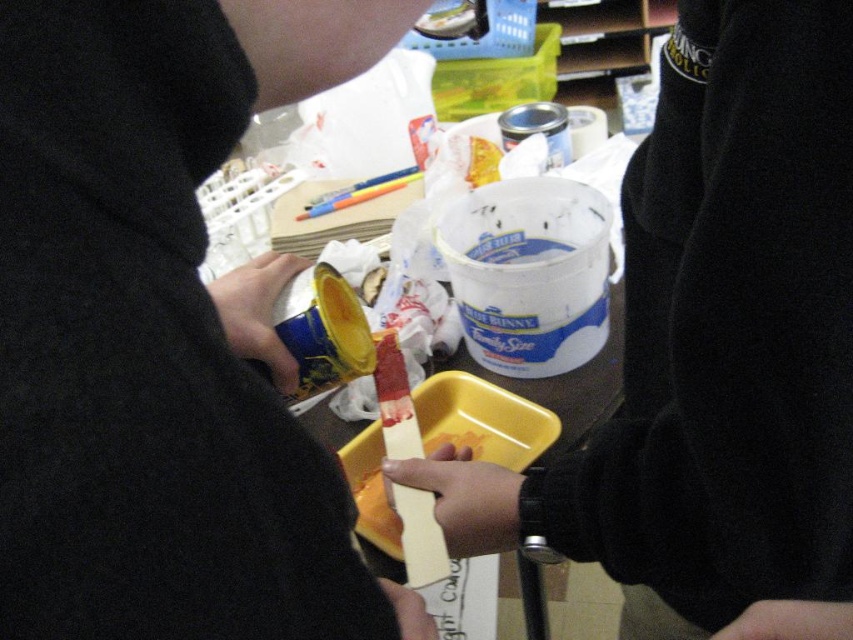
Consider the image. You are a painter who needs to reach the metallic blue can at center to get more paint. You have a 6 inch long tool. Can you reach it with your tool?

The metallic blue can at center is 6.47 inches from the camera, so the 6 inch tool is too short to reach it. You need a longer tool.

You are an artist trying to locate the metallic blue can at center in the image. According to the coordinates provided, where exactly is it positioned?

The metallic blue can at center is located at point 0.520 in the x coordinate and 0.190 in the y coordinate.

You are an artist trying to organize your painting supplies. You need to place the metallic blue can at center and the yellow plastic tray at center in a specific order. According to the scene, which object is positioned to the left of the other?

The metallic blue can at center is to the left of the yellow plastic tray at center.